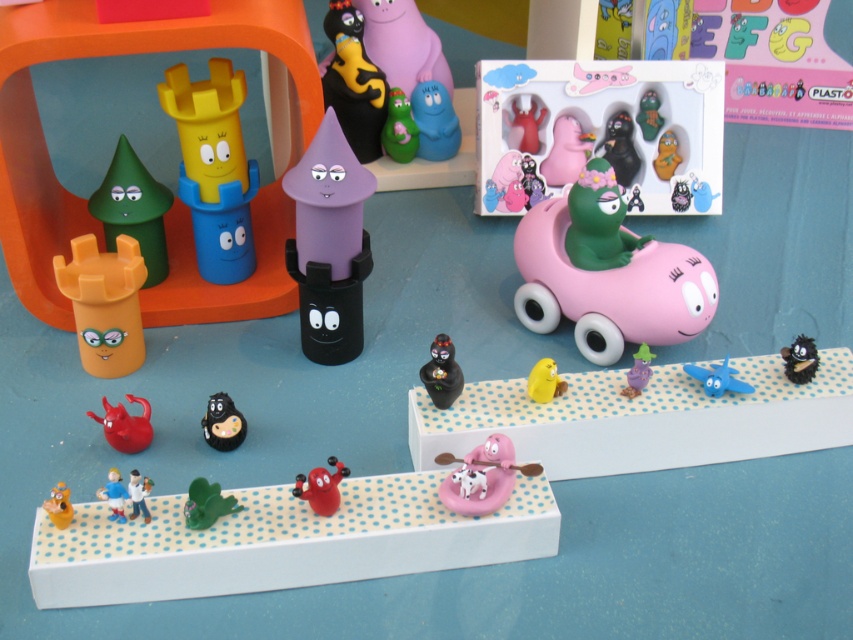
Question: Which point is farther to the camera?

Choices:
 (A) green matte cone at left
 (B) orange matte toy castle at left
 (C) pink rubber car at center

Answer: (A)

Question: Does matte black cat at upper center have a larger size compared to glossy plastic figure at center?

Choices:
 (A) no
 (B) yes

Answer: (B)

Question: Which point is closer to the camera taking this photo?

Choices:
 (A) (157, 214)
 (B) (553, 140)
 (C) (331, 88)

Answer: (A)

Question: Among these points, which one is farthest from the camera?

Choices:
 (A) (126, 371)
 (B) (643, 136)

Answer: (B)

Question: Is matte black cat at upper center to the right of plastic toy car at center from the viewer's perspective?

Choices:
 (A) no
 (B) yes

Answer: (A)

Question: Is glossy plastic figure at center below matte green frog at center?

Choices:
 (A) yes
 (B) no

Answer: (A)